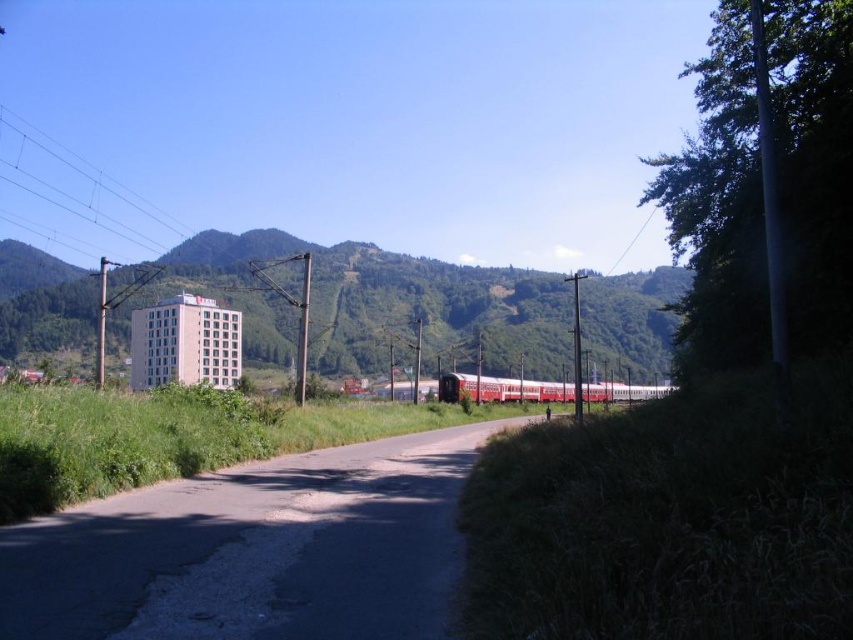
You are a photographer planning to take a photo of the green grassy hill at center and the red polished metal train at center from a position where both are visible. Which object will appear taller in the photo?

The green grassy hill at center will appear taller in the photo because it has a greater height compared to the red polished metal train at center.

You are standing at the starting point of the road and want to reach the end of the road. Which point, point [418,301] or point [88,205], is closer to you as you begin your journey?

Point [418,301] is closer to the camera than point [88,205]. Since you are at the starting point of the road, the closer point would be point [418,301].

You are a photographer planning to take a photo of the red polished metal train at center and the green grassy hill at center from the road. Which object will appear closer to the camera in the photo?

The green grassy hill at center will appear closer to the camera because the red polished metal train at center is positioned behind it.